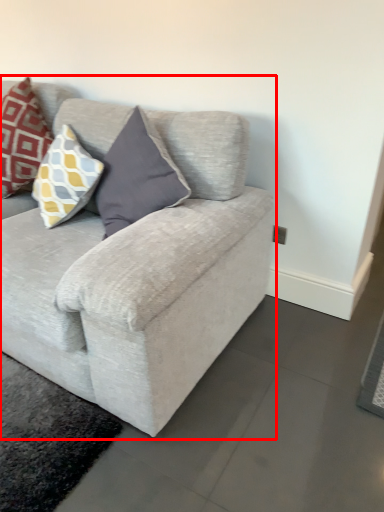
Question: From the image's perspective, what is the correct spatial positioning of studio couch (annotated by the red box) in reference to pillow?

Choices:
 (A) above
 (B) below

Answer: (B)